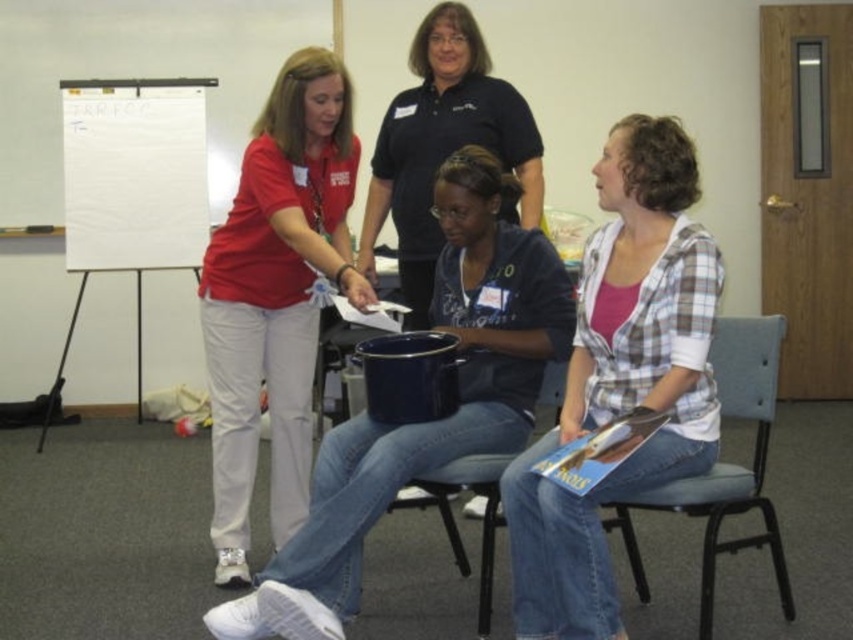
You are a photographer setting up for a group photo. You need to position yourself so that both the matte red shirt at center and the blue plastic chair at center are in focus. Which object should you focus on first to ensure both are sharp?

You should focus on the matte red shirt at center first because it is closer to you than the blue plastic chair at center, ensuring both will be in focus when using depth of field appropriately.

You are organizing a workshop and need to place a sign between the matte blue bucket at center and the blue plastic chair at center. Where should you place the sign so it is between them?

The sign should be placed between the matte blue bucket at center and the blue plastic chair at center, to the right of the matte blue bucket at center and to the left of the blue plastic chair at center since the bucket is on the left side of the chair.